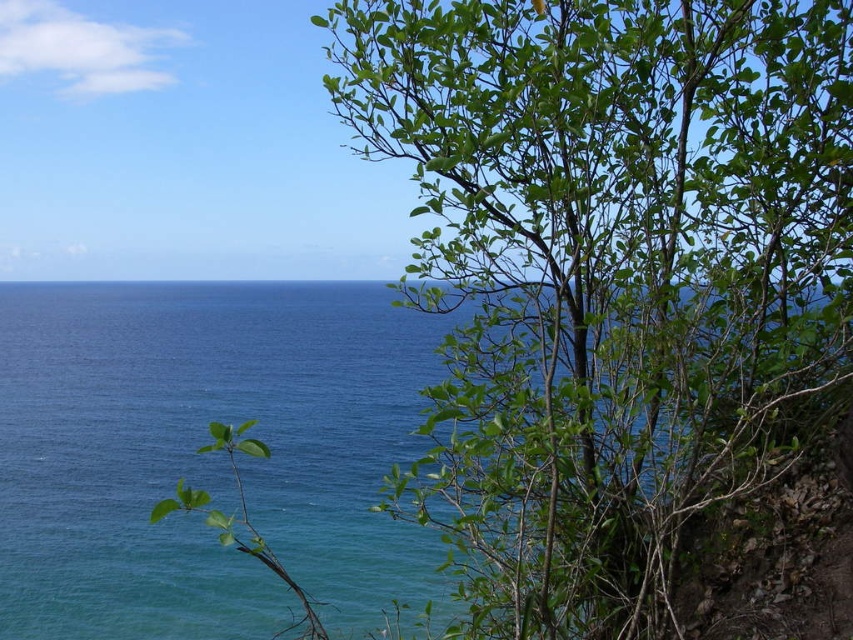
Image resolution: width=853 pixels, height=640 pixels. Describe the element at coordinates (608, 273) in the screenshot. I see `green leafy bush at right` at that location.

Which is more to the right, green leafy bush at right or blue water at center?

green leafy bush at right

This screenshot has width=853, height=640. I want to click on green leafy bush at right, so click(608, 273).